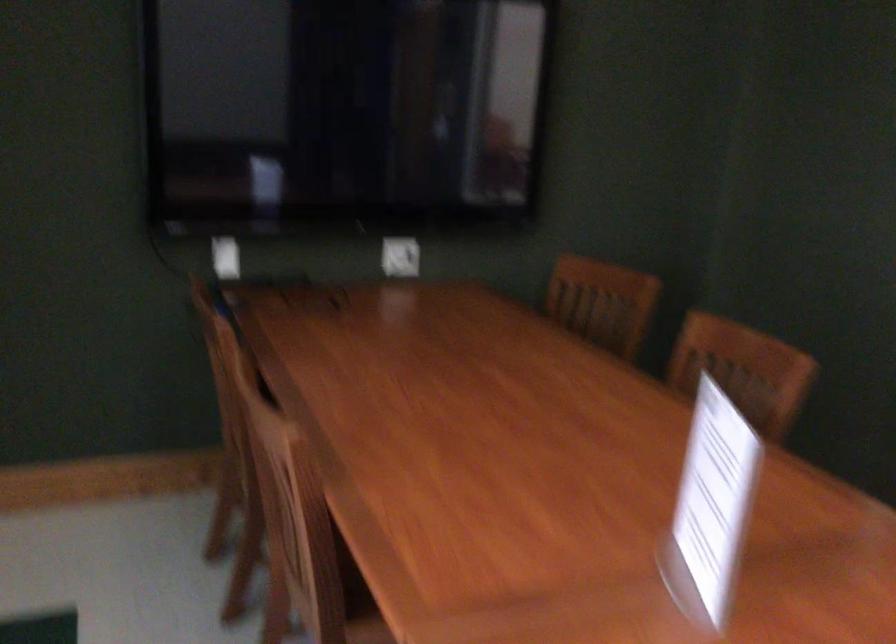
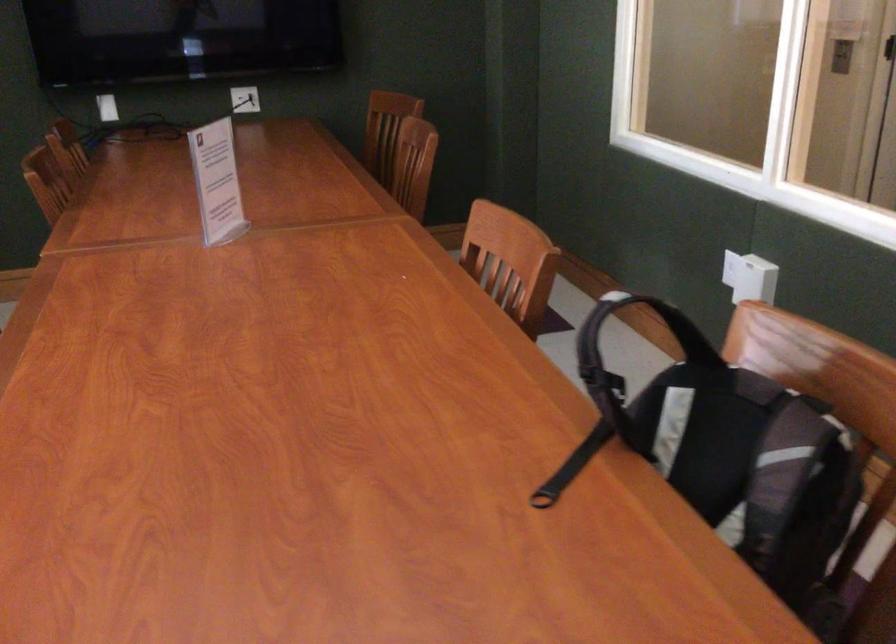
Where in the second image is the point corresponding to (401,261) from the first image?

(245, 99)